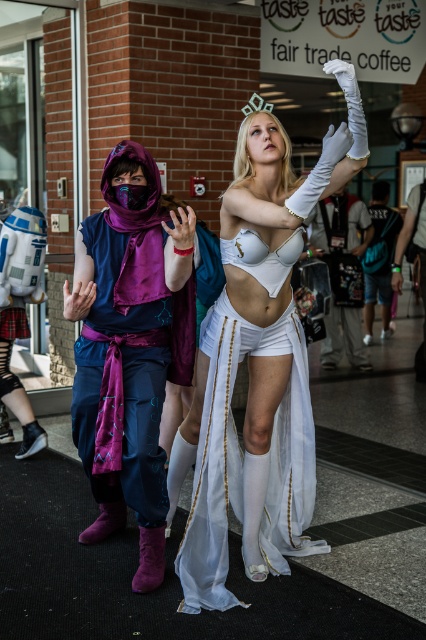
You are a photographer at a cosplay event and need to capture a closeup shot of the white satin dress at center and the purple velvet scarf at left. Your camera has a minimum focus distance of 20 inches. Can you take the photo without moving either object?

The distance between the white satin dress at center and the purple velvet scarf at left is 20.72 inches, which is slightly more than the camera minimum focus distance of 20 inches. Therefore, you can take the photo without moving either object.

You are standing in the convention hall and notice two points marked on the floor. The first point is at coordinate point(290, 538) and the second is at point(143, 582). Which point is closer to you?

Point(290, 538) is closer to you because it is further to the viewer than point(143, 582).